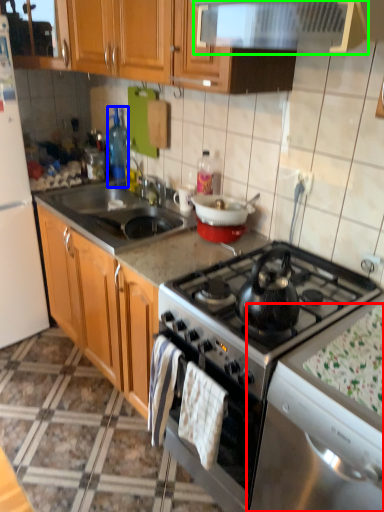
Question: Based on their relative distances, which object is nearer to silver (highlighted by a red box)? Choose from bottle (highlighted by a blue box) and exhaust hood (highlighted by a green box).

Choices:
 (A) bottle
 (B) exhaust hood

Answer: (B)